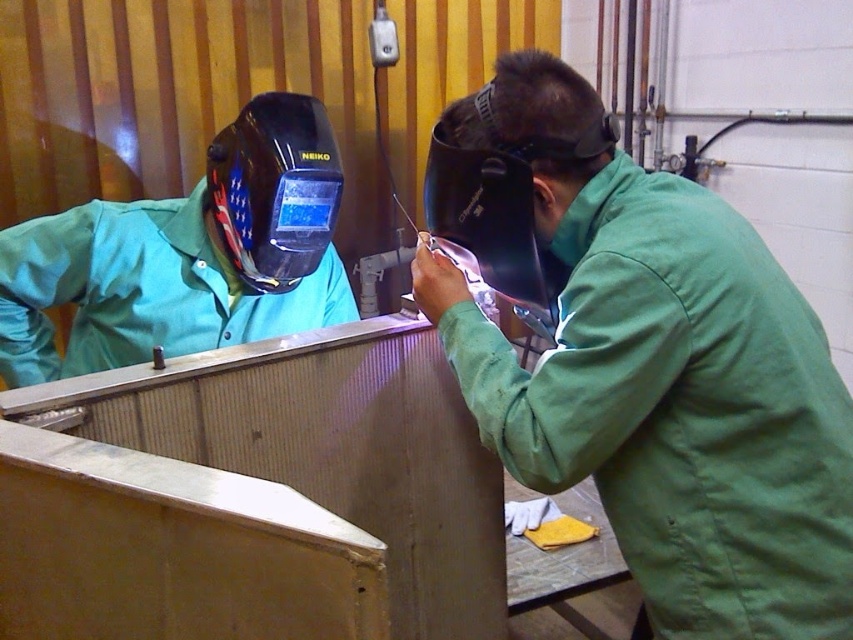
Is point (666, 621) behind point (223, 307)?

No, (666, 621) is in front of (223, 307).

Can you confirm if green matte welding suit at center is taller than matte black welding helmet at upper left?

Correct, green matte welding suit at center is much taller as matte black welding helmet at upper left.

This screenshot has height=640, width=853. What do you see at coordinates (659, 374) in the screenshot? I see `green matte welding suit at center` at bounding box center [659, 374].

Image resolution: width=853 pixels, height=640 pixels. Identify the location of green matte welding suit at center. (659, 374).